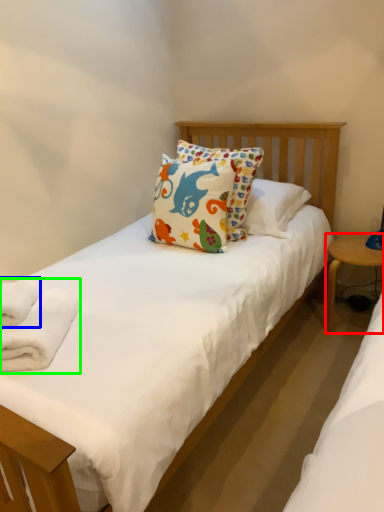
Question: Which is farther away from table (highlighted by a red box)? bath towel (highlighted by a blue box) or bath towel (highlighted by a green box)?

Choices:
 (A) bath towel
 (B) bath towel

Answer: (A)